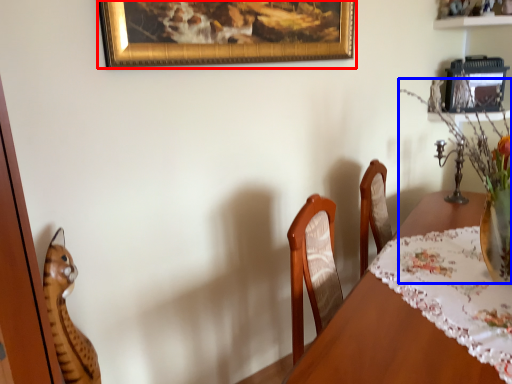
Question: Which of the following is the closest to the observer, picture frame (highlighted by a red box) or floral arrangement (highlighted by a blue box)?

Choices:
 (A) picture frame
 (B) floral arrangement

Answer: (B)